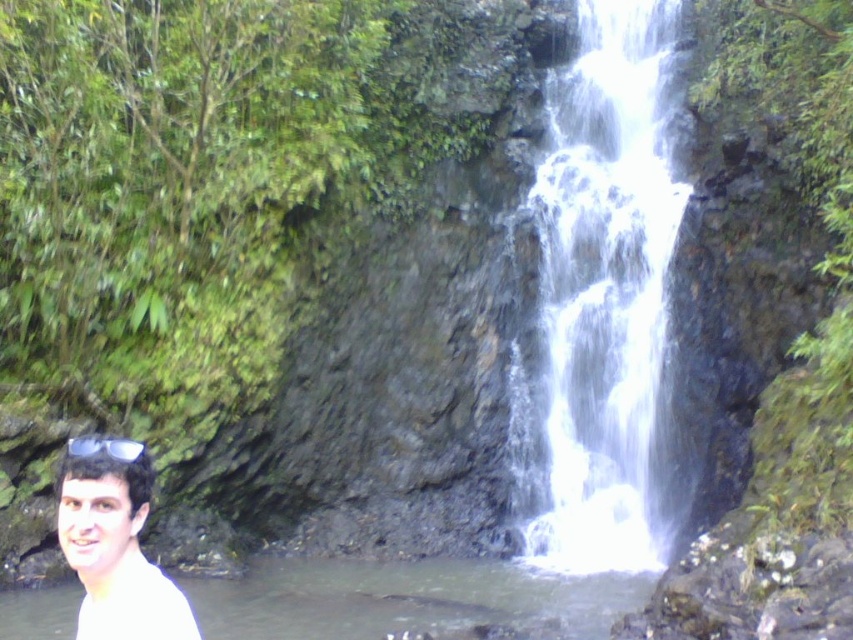
You are a hiker who wants to cross the stream near the waterfall. You notice the white frothy water at center and the clear plastic goggles at lower left. Which object is higher in elevation?

The white frothy water at center is taller than the clear plastic goggles at lower left, so the white frothy water at center is higher in elevation.

You are a drone operator trying to capture a photo of the waterfall. The camera is currently positioned at point A, which is at coordinates 0.5, 0.5. You need to adjust the camera to focus on the white frothy water at center. Should you move the camera up or down, left or right to get it centered in the frame?

The white frothy water at center is located at coordinates (602, 296). Since the camera is at (426, 320), you should move it slightly to the left and up to center the white frothy water at center. The x coordinate 0.464 is to the left of 0.5, and the y coordinate 0.707 is above 0.5.

You are a hiker who wants to cross the stream near the waterfall. You see the clear water at lower left and the white matte shirt at lower left. Which object is closer to you as you approach the stream?

The clear water at lower left is closer to you because the white matte shirt at lower left is behind it.